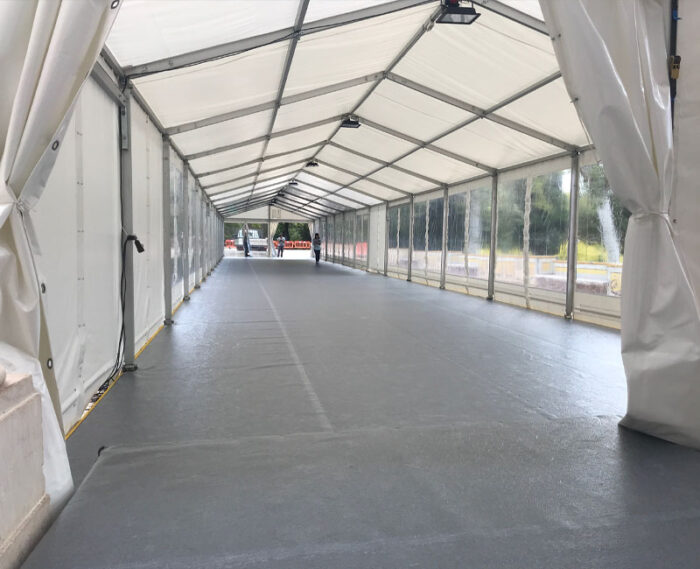
The height and width of the screenshot is (569, 700). What are the coordinates of `outlet of extension cord` in the screenshot? It's located at (139, 245).